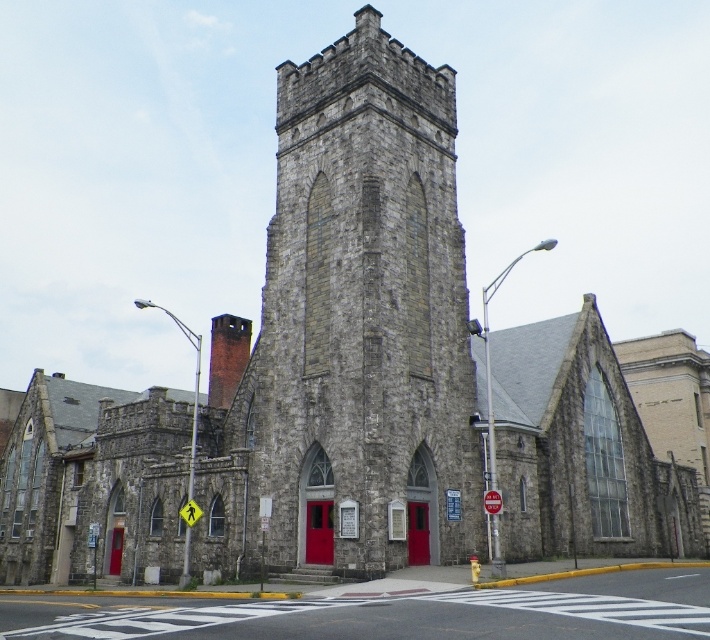
You are standing in front of the historic stone church and want to locate the gray stone tower at center. According to the architectural layout, where would you find it relative to the church building?

The gray stone tower at center is located at the central point of the church building, as indicated by its coordinates at point (361, 321), which places it at the center of the image.

You are a tourist standing on the smooth asphalt road at center and want to take a photo of the gray stone tower at center. Since the tower is larger in the image, will it occupy more space in your photo compared to the road?

Yes, the gray stone tower at center has a larger size compared to the smooth asphalt road at center, so it will occupy more space in the photo.

You are a tourist standing at the entrance of the historic stone church and want to take a photo of the gray stone tower at center and the smooth asphalt road at center. Which object should you focus on first if you want to capture both in the frame?

The gray stone tower at center is positioned on the left side of smooth asphalt road at center, so you should focus on the gray stone tower at center first to ensure both objects are in the frame.